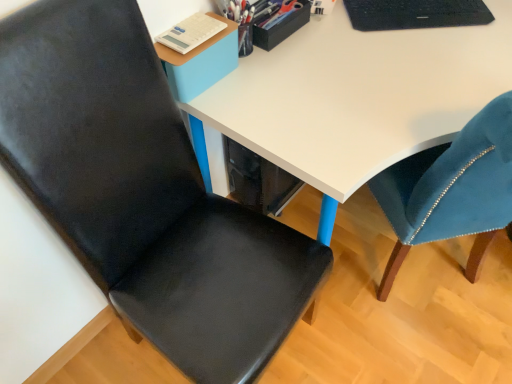
Find the location of a particular element. vacant space underneath black textured laptop at upper right (from a real-world perspective) is located at coordinates (420, 17).